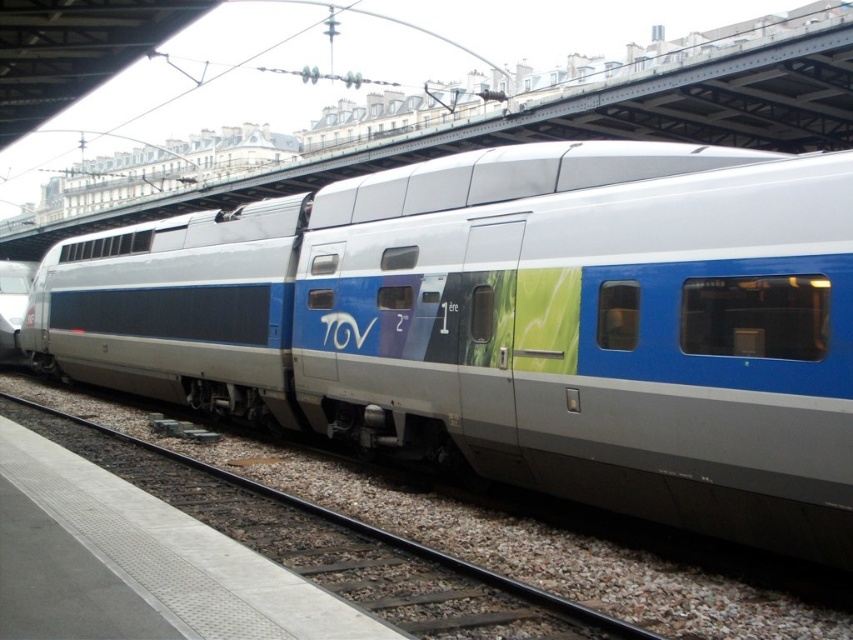
Question: Is silver metallic train at center smaller than metal/smooth track at lower center?

Choices:
 (A) no
 (B) yes

Answer: (A)

Question: Does silver metallic train at center appear over metal/smooth track at lower center?

Choices:
 (A) yes
 (B) no

Answer: (A)

Question: Does silver metallic train at center have a larger size compared to metal/smooth track at lower center?

Choices:
 (A) yes
 (B) no

Answer: (A)

Question: Which of the following is the closest to the observer?

Choices:
 (A) silver metallic train at center
 (B) metal/smooth track at lower center

Answer: (B)